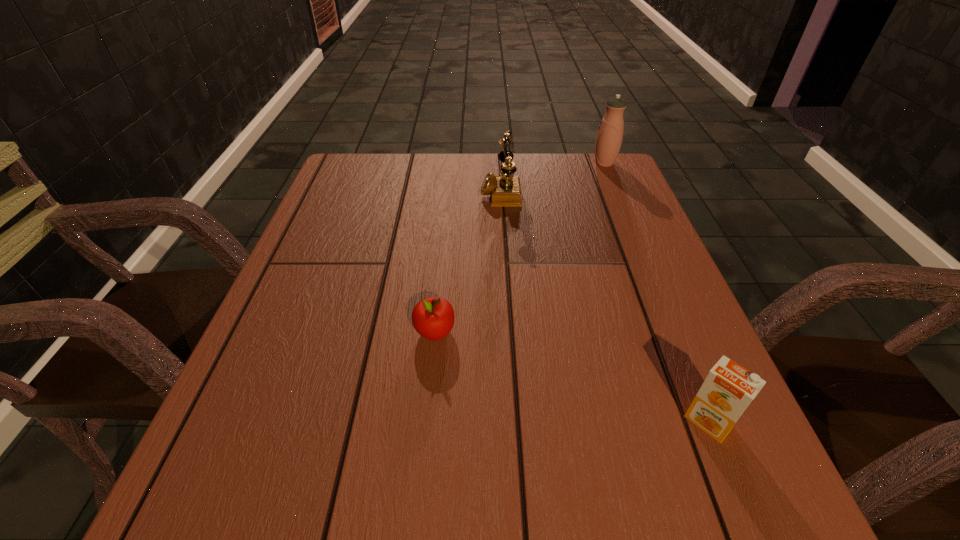
The height and width of the screenshot is (540, 960). I want to click on blank region between the telephone and the third tallest object, so click(604, 306).

Locate an element on the screen. This screenshot has height=540, width=960. free space between the third farthest object and the farthest object is located at coordinates (519, 248).

At what (x,y) coordinates should I click in order to perform the action: click on vacant space that is in between the shortest object and the orange juice. Please return your answer as a coordinate pair (x, y). This screenshot has width=960, height=540. Looking at the image, I should click on (571, 376).

Find the location of a particular element. The image size is (960, 540). vacant space that's between the orange juice and the apple is located at coordinates (571, 376).

The width and height of the screenshot is (960, 540). In order to click on free spot between the farthest object and the second shortest object in this screenshot , I will do `click(657, 293)`.

I want to click on object that is the third closest one to the tallest object, so click(729, 388).

The height and width of the screenshot is (540, 960). In order to click on object that stands as the third closest to the orange juice in this screenshot , I will do `click(609, 138)`.

Identify the location of vacant space that satisfies the following two spatial constraints: 1. on the dial number of the nearest object; 2. on the left side of the telephone. The height and width of the screenshot is (540, 960). (515, 421).

This screenshot has width=960, height=540. In order to click on vacant space that satisfies the following two spatial constraints: 1. on the front side of the nearest object; 2. on the right side of the apple in this screenshot , I will do `click(426, 421)`.